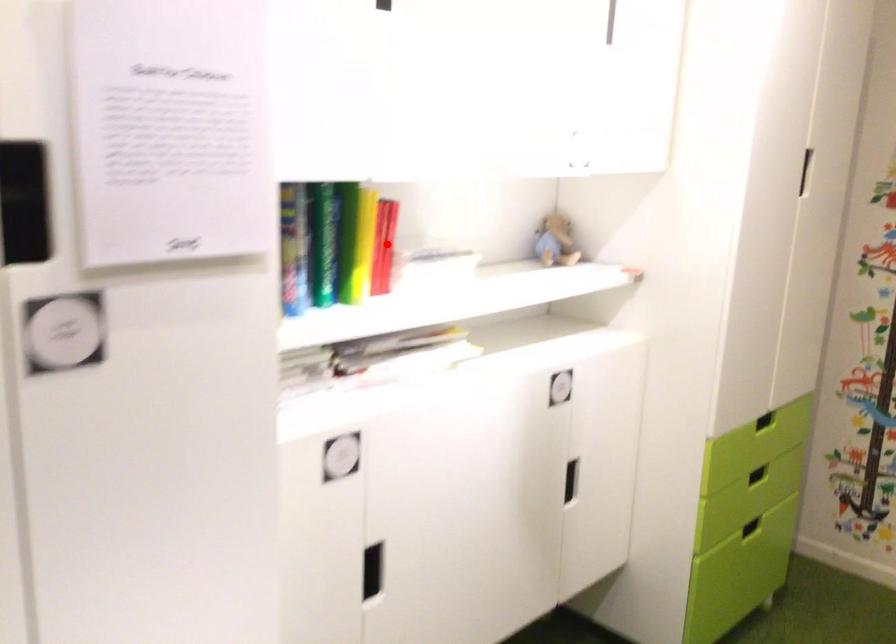
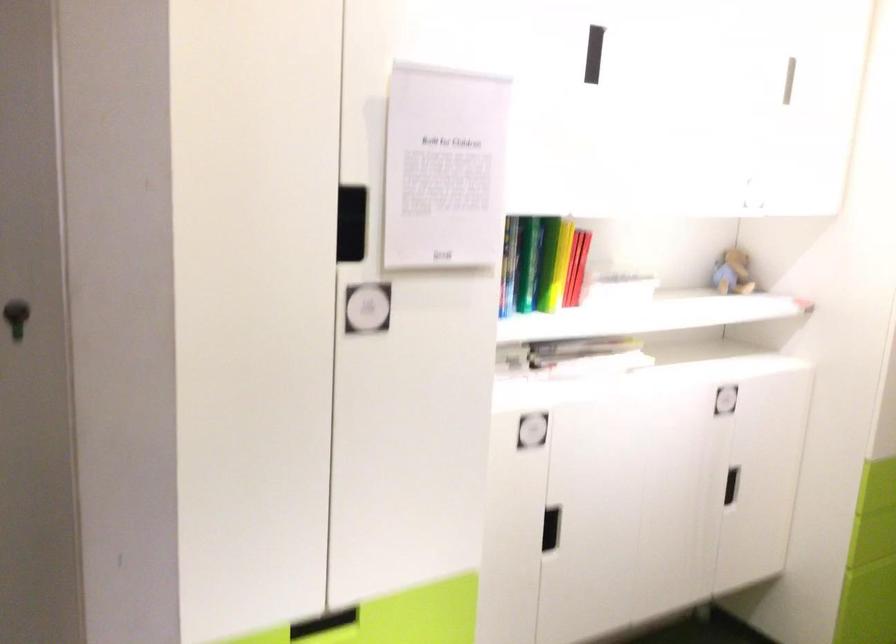
Question: I am providing you with two images of the same scene from different viewpoints. Given a red point in image1, look at the same physical point in image2. Is it:

Choices:
 (A) Closer to the viewpoint
 (B) Farther from the viewpoint

Answer: (B)